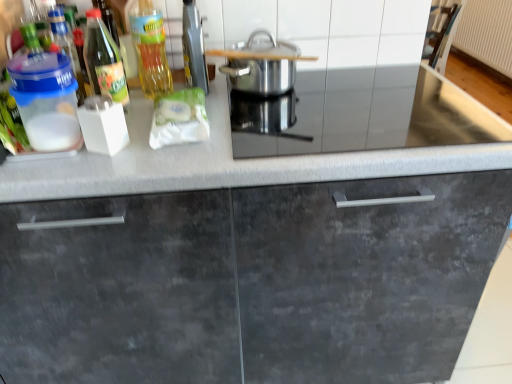
Where is `space that is in front of translucent glass bottle at upper left, the second bottle viewed from the left`? The width and height of the screenshot is (512, 384). space that is in front of translucent glass bottle at upper left, the second bottle viewed from the left is located at coordinates (111, 158).